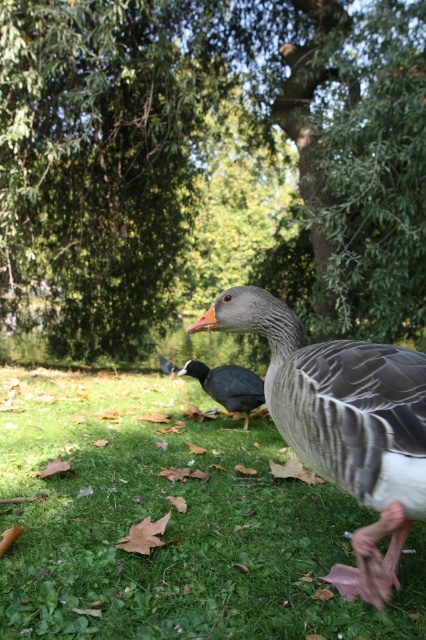
Question: Which object is farther from the camera taking this photo?

Choices:
 (A) green leafy tree at center
 (B) green grassy at lower center
 (C) black matte duck at center
 (D) black glossy duckling at center

Answer: (D)

Question: Can you confirm if green grassy at lower center is smaller than gray feathered duck at center?

Choices:
 (A) no
 (B) yes

Answer: (A)

Question: From the image, what is the correct spatial relationship of green grassy at lower center in relation to black matte duck at center?

Choices:
 (A) left
 (B) right

Answer: (A)

Question: Does green leafy tree at center have a smaller size compared to green grassy at lower center?

Choices:
 (A) no
 (B) yes

Answer: (A)

Question: Estimate the real-world distances between objects in this image. Which object is farther from the black glossy duckling at center?

Choices:
 (A) green leafy tree at center
 (B) green grassy at lower center
 (C) gray feathered duck at center

Answer: (C)

Question: Estimate the real-world distances between objects in this image. Which object is farther from the black glossy duckling at center?

Choices:
 (A) green grassy at lower center
 (B) gray feathered duck at center
 (C) black matte duck at center

Answer: (B)